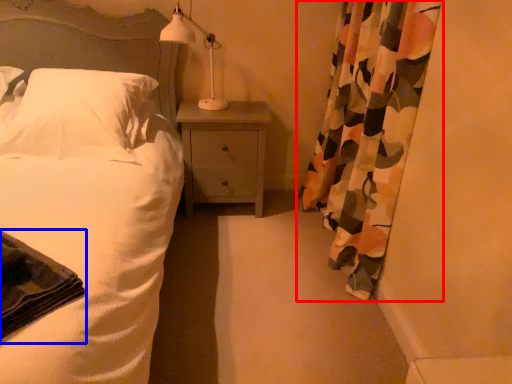
Question: Which object appears farthest to the camera in this image, curtain (highlighted by a red box) or material (highlighted by a blue box)?

Choices:
 (A) curtain
 (B) material

Answer: (A)